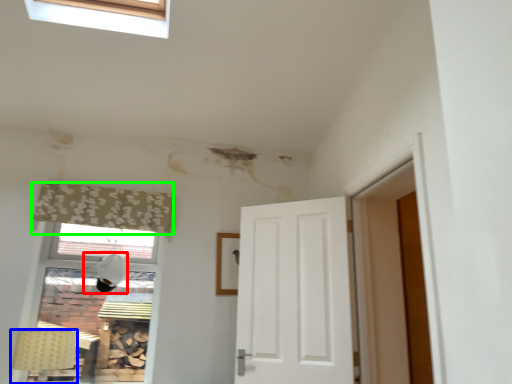
Question: Which object is positioned closest to lamp (highlighted by a red box)? Select from lamp (highlighted by a blue box) and curtain (highlighted by a green box).

Choices:
 (A) lamp
 (B) curtain

Answer: (B)